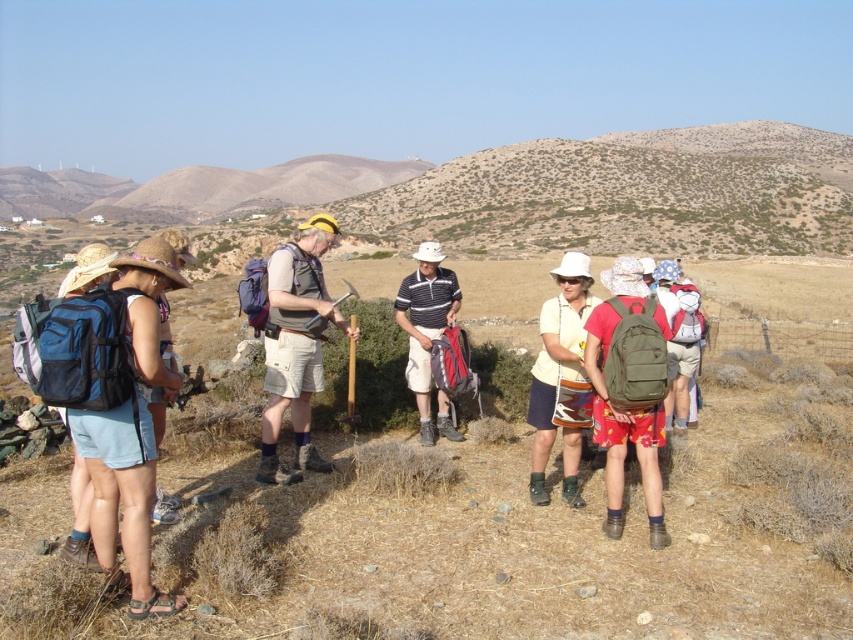
You are a photographer standing in the arid landscape and want to take a photo of the matte gray vest at center and the matte yellow shirt at center. If your camera can only focus on objects within a 2.5 meter range, will both subjects be in focus?

The matte gray vest at center is 3.00 meters from the matte yellow shirt at center. Since the camera can only focus within a 2.5 meter range, the distance between them exceeds this limit. Therefore, both subjects cannot be in focus simultaneously.

You are standing at the point labeled point (283, 387) and want to walk to the point labeled point (140, 608). Which direction should you face to walk directly towards your destination?

You should face northeast to walk directly towards point (140, 608) from point (283, 387).

You are a photographer trying to capture a group photo of the matte gray vest at center and the matte yellow shirt at center. Since you want both subjects to appear equally sized in the photo, which subject should you move closer to the camera?

The matte gray vest at center has a larger size compared to matte yellow shirt at center, so you should move the matte gray vest at center further away from the camera and bring the matte yellow shirt at center closer to balance their sizes in the photo.